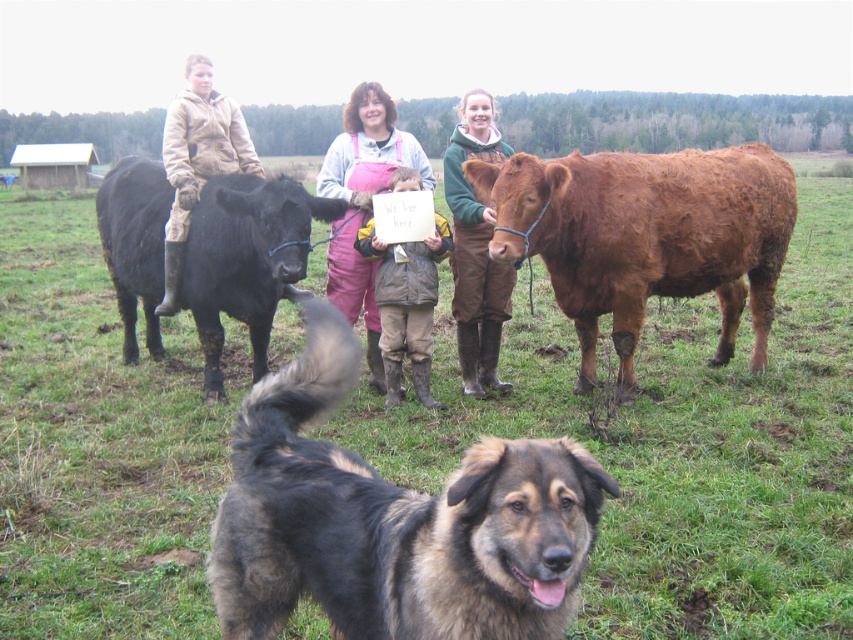
Looking at this image, is brown fur dog at center to the right of black glossy bull at left from the viewer's perspective?

Indeed, brown fur dog at center is positioned on the right side of black glossy bull at left.

Who is more distant from viewer, (x=338, y=380) or (x=286, y=282)?

Positioned behind is point (x=286, y=282).

Locate an element on the screen. The height and width of the screenshot is (640, 853). brown fur dog at center is located at coordinates (393, 522).

Which is in front, point (682, 186) or point (387, 173)?

Point (682, 186) is more forward.

Which is more to the left, brown fuzzy bull at right or pink overalls at center?

pink overalls at center

Is point (614, 310) positioned after point (384, 148)?

No.

Locate an element on the screen. brown fuzzy bull at right is located at coordinates (646, 237).

Can you confirm if pink overalls at center is positioned above light brown leather jacket at upper left?

No, pink overalls at center is not above light brown leather jacket at upper left.

Does pink overalls at center appear on the left side of light brown leather jacket at upper left?

In fact, pink overalls at center is to the right of light brown leather jacket at upper left.

Locate an element on the screen. Image resolution: width=853 pixels, height=640 pixels. pink overalls at center is located at coordinates (363, 202).